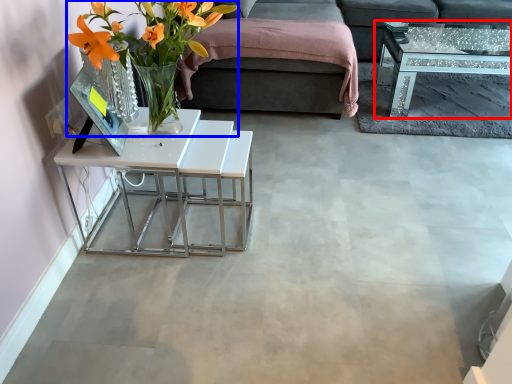
Question: Which point is closer to the camera, coffee table (highlighted by a red box) or floral arrangement (highlighted by a blue box)?

Choices:
 (A) coffee table
 (B) floral arrangement

Answer: (B)